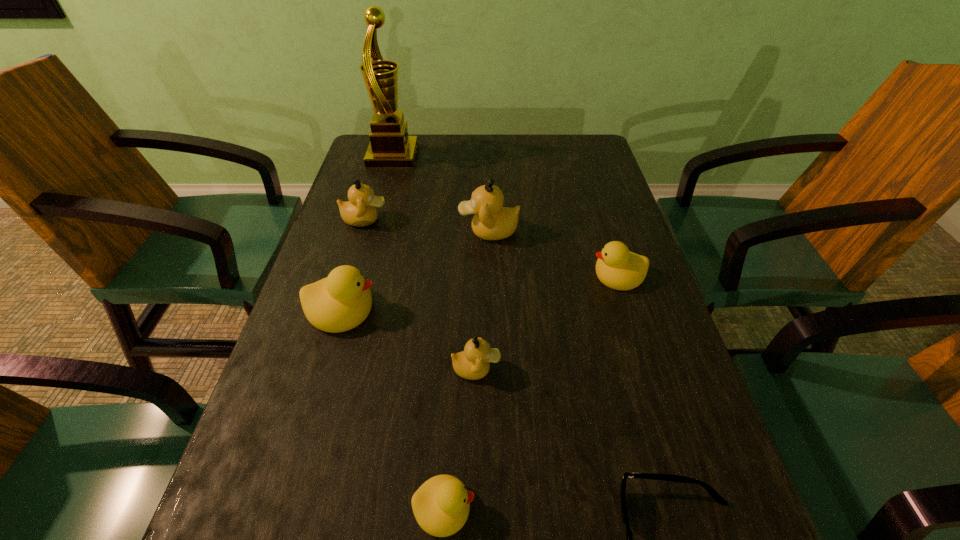
Where is `free space located 0.330m on the face of the rightmost yellow duckling`? This screenshot has width=960, height=540. free space located 0.330m on the face of the rightmost yellow duckling is located at coordinates (444, 275).

Identify the location of vacant space located on the face of the nearest tan duckling. This screenshot has width=960, height=540. (679, 369).

The width and height of the screenshot is (960, 540). What are the coordinates of `vacant position located on the face of the nearest yellow duckling` in the screenshot? It's located at (536, 508).

Where is `object that is at the far edge`? Image resolution: width=960 pixels, height=540 pixels. object that is at the far edge is located at coordinates (390, 147).

Identify the location of award that is at the left edge. This screenshot has width=960, height=540. (390, 147).

This screenshot has width=960, height=540. I want to click on object at the right edge, so click(618, 268).

Where is `object that is at the far left corner`? This screenshot has height=540, width=960. object that is at the far left corner is located at coordinates (390, 147).

In the image, there is a desktop. Where is `blank space at the far edge`? blank space at the far edge is located at coordinates (421, 170).

Where is `blank space at the left edge of the desktop`? blank space at the left edge of the desktop is located at coordinates (299, 355).

I want to click on free space at the right edge of the desktop, so click(x=672, y=487).